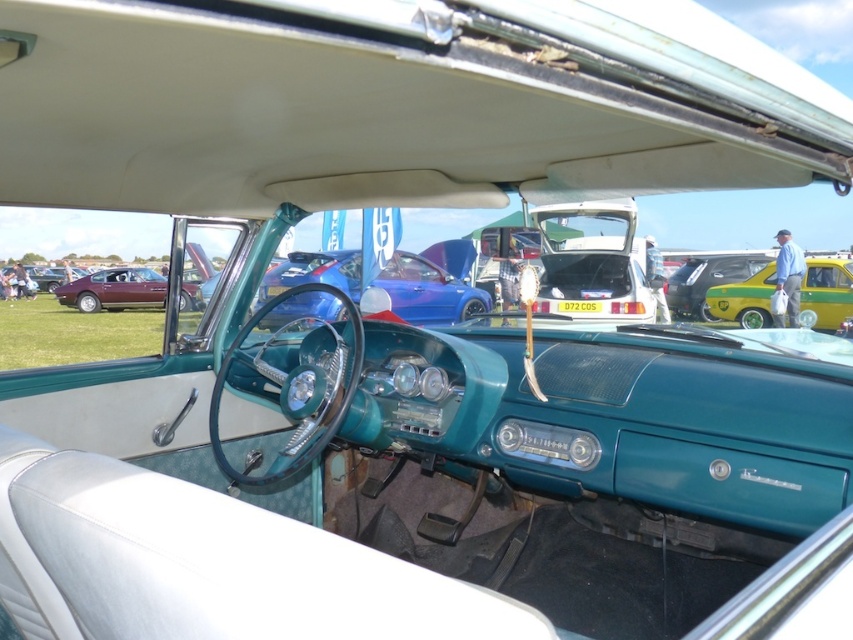
You are a driver trying to park your car in a narrow alley. You see the yellow matte car at right and the shiny maroon car at left parked there. Which car has a smaller width and might be easier to maneuver in tight spaces?

The yellow matte car at right has a lesser width compared to the shiny maroon car at left, so it might be easier to maneuver in tight spaces.

You are a photographer trying to capture both the yellow matte car at right and the shiny maroon car at left in a single frame. Given their sizes in the image, which car should you focus on to ensure both fit comfortably without cropping?

Since the yellow matte car at right occupies less space than the shiny maroon car at left, you should focus on positioning the camera so that the larger shiny maroon car at left is centered, allowing the smaller yellow matte car at right to fit naturally within the frame.